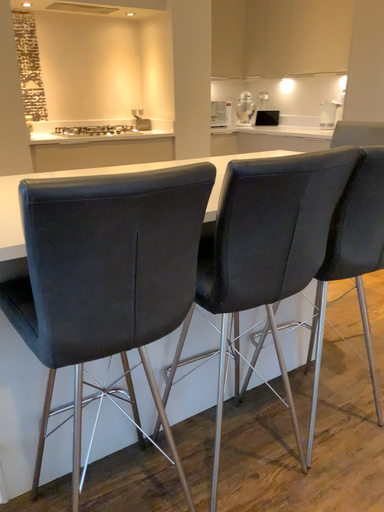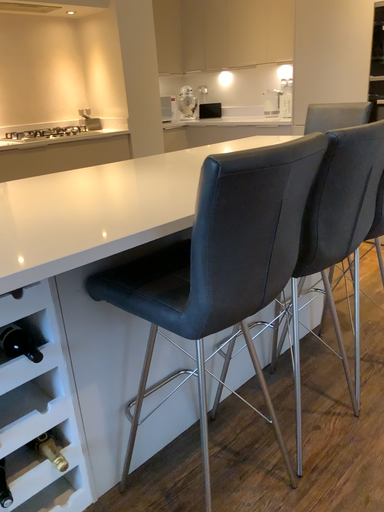
Question: How did the camera likely rotate when shooting the video?

Choices:
 (A) rotated left
 (B) rotated right

Answer: (B)